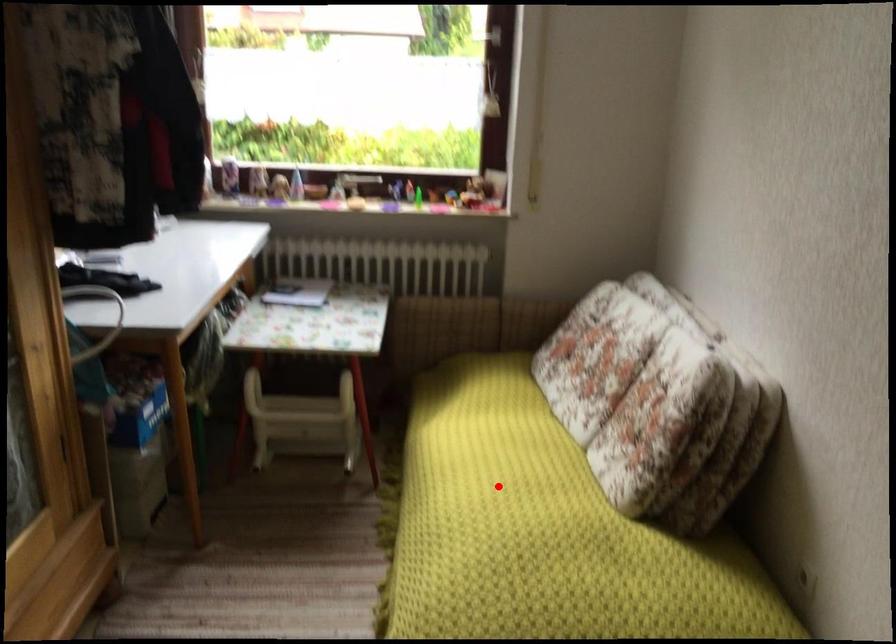
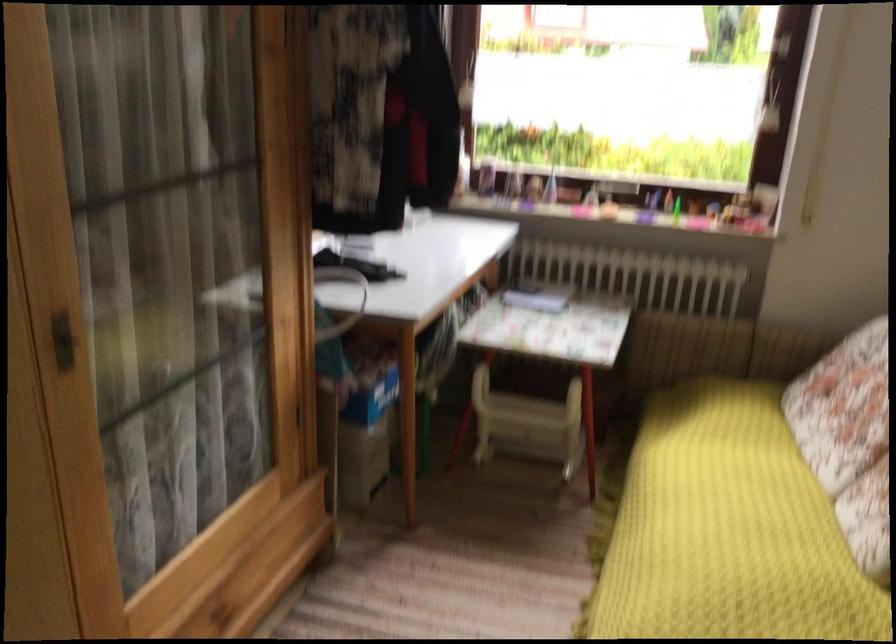
Question: I am providing you with two images of the same scene from different viewpoints. Image1 has a red point marked. In image2, the corresponding 3D location appears at what relative position? Reply with the corresponding letter.

Choices:
 (A) Closer
 (B) Farther

Answer: (A)